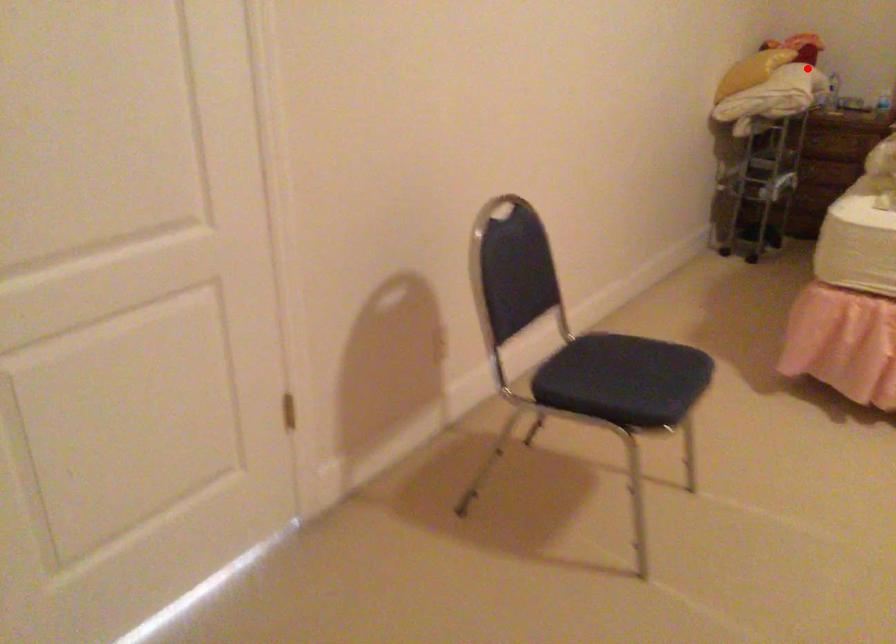
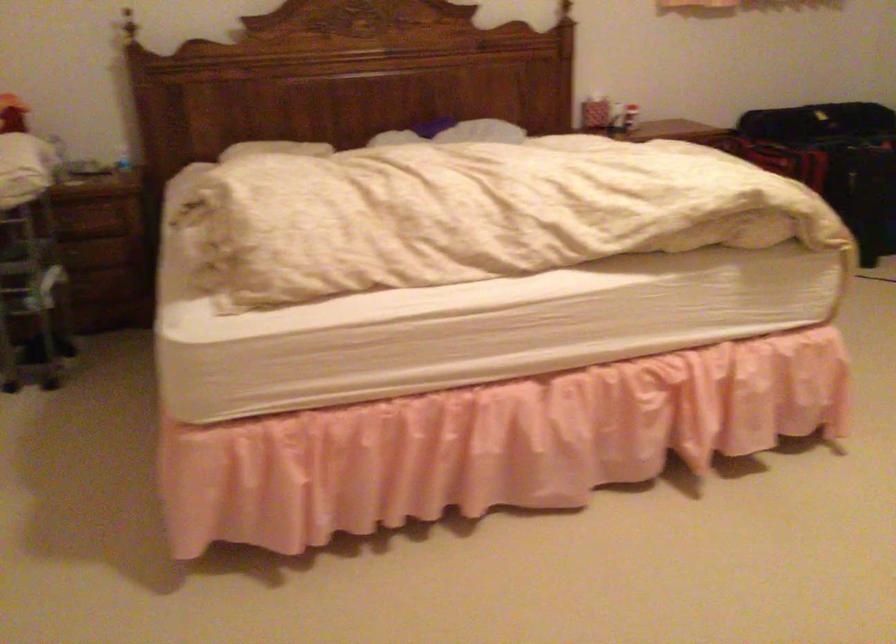
Locate, in the second image, the point that corresponds to the highlighted location in the first image.

(59, 158)